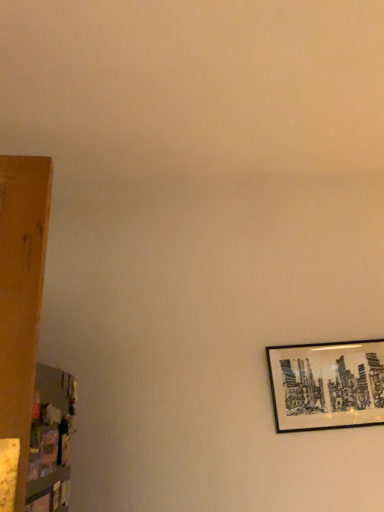
Where is `wooden shelf at left`? This screenshot has height=512, width=384. wooden shelf at left is located at coordinates (50, 440).

In order to face wooden shelf at left, should I rotate leftwards or rightwards?

Rotate left and turn 17.797 degrees.

The image size is (384, 512). Describe the element at coordinates (50, 440) in the screenshot. I see `wooden shelf at left` at that location.

What is the approximate width of black matte picture frame at right?

black matte picture frame at right is 2.05 inches in width.

The height and width of the screenshot is (512, 384). I want to click on black matte picture frame at right, so click(x=327, y=385).

Describe the element at coordinates (327, 385) in the screenshot. Image resolution: width=384 pixels, height=512 pixels. I see `black matte picture frame at right` at that location.

Where is `wooden shelf at left`? This screenshot has height=512, width=384. wooden shelf at left is located at coordinates click(x=50, y=440).

Does wooden shelf at left appear on the left side of black matte picture frame at right?

Yes, wooden shelf at left is to the left of black matte picture frame at right.

Consider the image. In the image, is wooden shelf at left positioned in front of or behind black matte picture frame at right?

wooden shelf at left is in front of black matte picture frame at right.

Which is more distant, (66, 372) or (338, 362)?

The point (338, 362) is more distant.

From the image's perspective, is wooden shelf at left above or below black matte picture frame at right?

wooden shelf at left is above black matte picture frame at right.

From a real-world perspective, is wooden shelf at left below black matte picture frame at right?

Correct, in the physical world, wooden shelf at left is lower than black matte picture frame at right.

Does wooden shelf at left have a lesser width compared to black matte picture frame at right?

Yes, wooden shelf at left is thinner than black matte picture frame at right.

In terms of height, does wooden shelf at left look taller or shorter compared to black matte picture frame at right?

Clearly, wooden shelf at left is taller compared to black matte picture frame at right.

Can you confirm if wooden shelf at left is smaller than black matte picture frame at right?

Yes.

Is wooden shelf at left inside or outside of black matte picture frame at right?

wooden shelf at left exists outside the volume of black matte picture frame at right.

Is wooden shelf at left next to black matte picture frame at right?

No, wooden shelf at left is not with black matte picture frame at right.

From the picture: Is black matte picture frame at right at the back of wooden shelf at left?

wooden shelf at left is not turned away from black matte picture frame at right.

How many degrees apart are the facing directions of wooden shelf at left and black matte picture frame at right?

They differ by 85.5 degrees in their facing directions.

How much distance is there between wooden shelf at left and black matte picture frame at right?

They are 3.55 feet apart.

Where is `picture frame below the wooden shelf at left (from the image's perspective)`? This screenshot has width=384, height=512. picture frame below the wooden shelf at left (from the image's perspective) is located at coordinates (327, 385).

Which is more to the right, black matte picture frame at right or wooden shelf at left?

Positioned to the right is black matte picture frame at right.

Is the depth of black matte picture frame at right less than that of wooden shelf at left?

No, black matte picture frame at right is behind wooden shelf at left.

Which point is more distant from viewer, (354, 387) or (35, 422)?

The point (354, 387) is farther.

From the image's perspective, is black matte picture frame at right above or below wooden shelf at left?

Based on their image positions, black matte picture frame at right is located beneath wooden shelf at left.

From a real-world perspective, which object stands above the other?

black matte picture frame at right is physically above.

Based on the photo, in terms of width, does black matte picture frame at right look wider or thinner when compared to wooden shelf at left?

In the image, black matte picture frame at right appears to be wider than wooden shelf at left.

Which of these two, black matte picture frame at right or wooden shelf at left, stands shorter?

Standing shorter between the two is black matte picture frame at right.

Between black matte picture frame at right and wooden shelf at left, which one has smaller size?

wooden shelf at left.

Can wooden shelf at left be found inside black matte picture frame at right?

No, wooden shelf at left is not inside black matte picture frame at right.

Is black matte picture frame at right with wooden shelf at left?

No, black matte picture frame at right is not making contact with wooden shelf at left.

Could you tell me if black matte picture frame at right is turned towards wooden shelf at left?

No, black matte picture frame at right is not aimed at wooden shelf at left.

How different are the orientations of black matte picture frame at right and wooden shelf at left in degrees?

85.5 degrees separate the facing orientations of black matte picture frame at right and wooden shelf at left.

How far apart are black matte picture frame at right and wooden shelf at left?

black matte picture frame at right and wooden shelf at left are 3.55 feet apart from each other.

Locate an element on the screen. The height and width of the screenshot is (512, 384). picture frame behind the wooden shelf at left is located at coordinates (327, 385).

The image size is (384, 512). I want to click on picture frame on the right side of wooden shelf at left, so click(327, 385).

Identify the location of shelf that appears on the left of black matte picture frame at right. The image size is (384, 512). (50, 440).